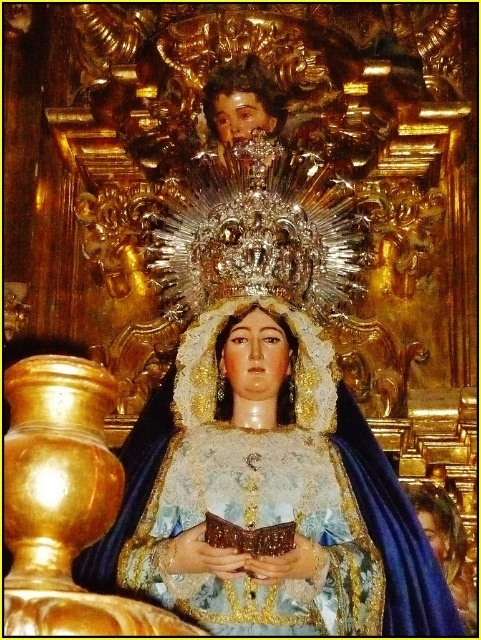
Measure the distance between matte blue fabric at center and smooth golden hair at lower right.

matte blue fabric at center and smooth golden hair at lower right are 53.01 feet apart.

Is matte blue fabric at center wider than smooth golden hair at lower right?

Indeed, matte blue fabric at center has a greater width compared to smooth golden hair at lower right.

Image resolution: width=481 pixels, height=640 pixels. What do you see at coordinates (256, 490) in the screenshot?
I see `matte blue fabric at center` at bounding box center [256, 490].

Locate an element on the screen. This screenshot has width=481, height=640. matte blue fabric at center is located at coordinates (256, 490).